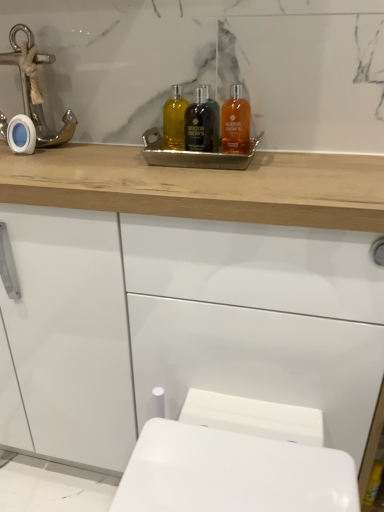
Locate an element on the screen. The width and height of the screenshot is (384, 512). free space between metallic anchor at left and metallic tray at center is located at coordinates (104, 148).